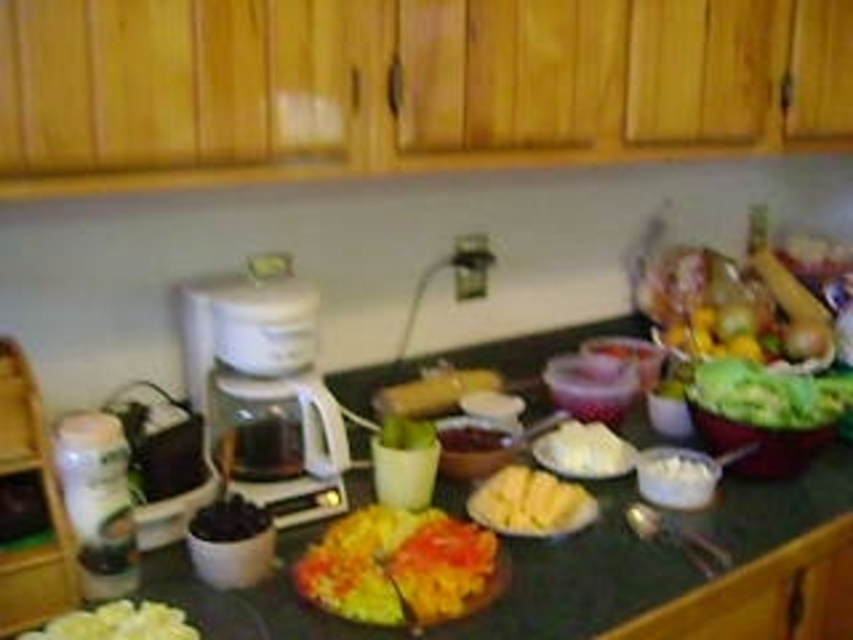
Is shiny yellow corn at center thinner than dark matte blueberries at center?

No, shiny yellow corn at center is not thinner than dark matte blueberries at center.

Who is positioned more to the left, shiny yellow corn at center or dark matte blueberries at center?

dark matte blueberries at center is more to the left.

Find the location of a particular element. shiny yellow corn at center is located at coordinates (396, 564).

I want to click on shiny yellow corn at center, so click(x=396, y=564).

Is green matte counter top at center positioned at the back of white glass coffee maker at center?

No, green matte counter top at center is in front of white glass coffee maker at center.

Measure the distance from green matte counter top at center to white glass coffee maker at center.

The distance of green matte counter top at center from white glass coffee maker at center is 10.58 inches.

Find the location of a particular element. green matte counter top at center is located at coordinates (688, 568).

Who is higher up, green matte counter top at center or white creamy bowl at center?

white creamy bowl at center

Is point (697, 528) positioned before point (648, 456)?

Yes, it is in front of point (648, 456).

At what (x,y) coordinates should I click in order to perform the action: click on green matte counter top at center. Please return your answer as a coordinate pair (x, y). The image size is (853, 640). Looking at the image, I should click on (688, 568).

The image size is (853, 640). What are the coordinates of `green matte counter top at center` in the screenshot? It's located at (688, 568).